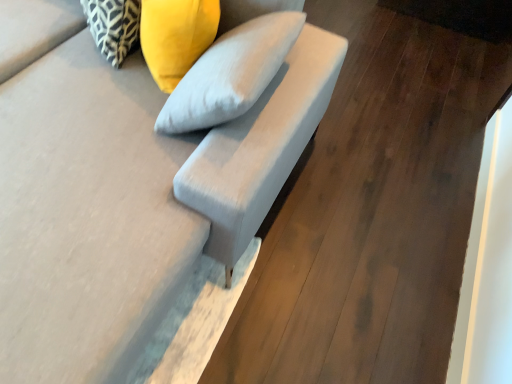
Question: From a real-world perspective, is suede-like gray armchair at center physically located above or below suede gray sofa at center?

Choices:
 (A) below
 (B) above

Answer: (B)

Question: Is suede-like gray armchair at center wider or thinner than suede gray sofa at center?

Choices:
 (A) wide
 (B) thin

Answer: (B)

Question: Estimate the real-world distances between objects in this image. Which object is closer to the suede-like gray armchair at center?

Choices:
 (A) patterned fabric pillow at upper left, acting as the 2th pillow starting from the right
 (B) suede gray sofa at center
 (C) yellow fabric pillow at upper center, which ranks as the second pillow in left-to-right order

Answer: (B)

Question: Considering the real-world distances, which object is farthest from the yellow fabric pillow at upper center, the first pillow from the right?

Choices:
 (A) suede gray sofa at center
 (B) suede-like gray armchair at center
 (C) patterned fabric pillow at upper left, acting as the 2th pillow starting from the right

Answer: (B)